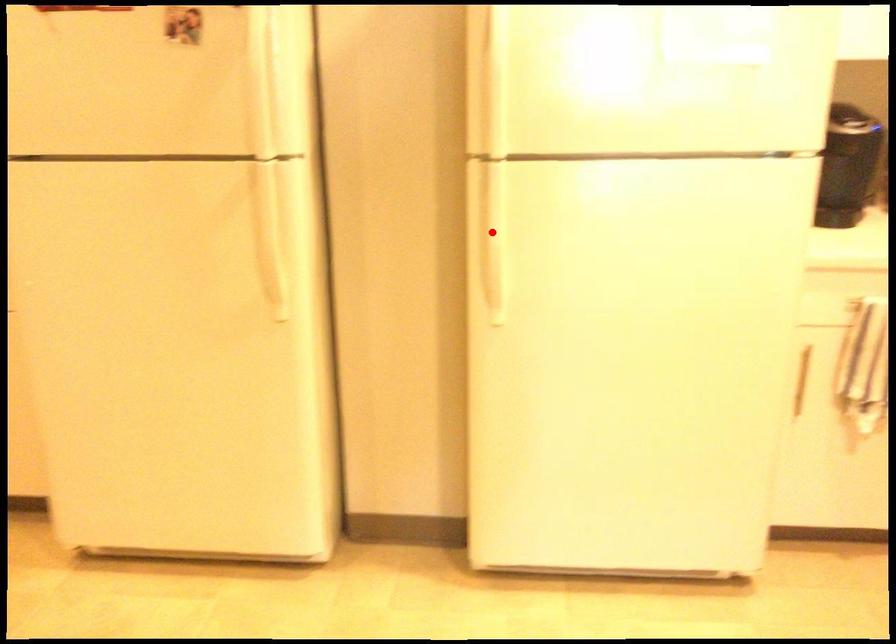
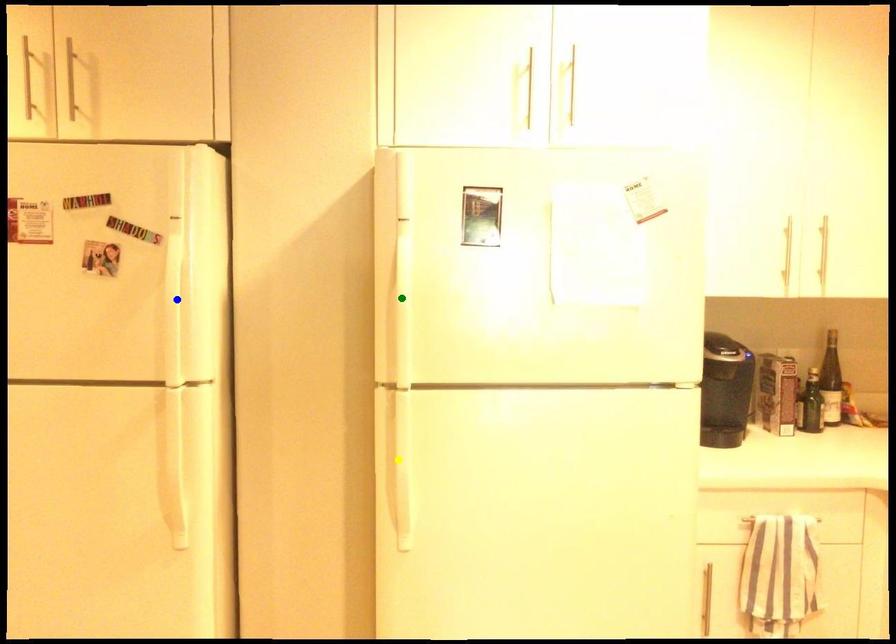
Question: I am providing you with two images of the same scene from different viewpoints. A red point is marked on the first image. You are given multiple points on the second image. Which point in image 2 is actually the same real-world point as the red point in image 1?

Choices:
 (A) green point
 (B) blue point
 (C) yellow point

Answer: (C)